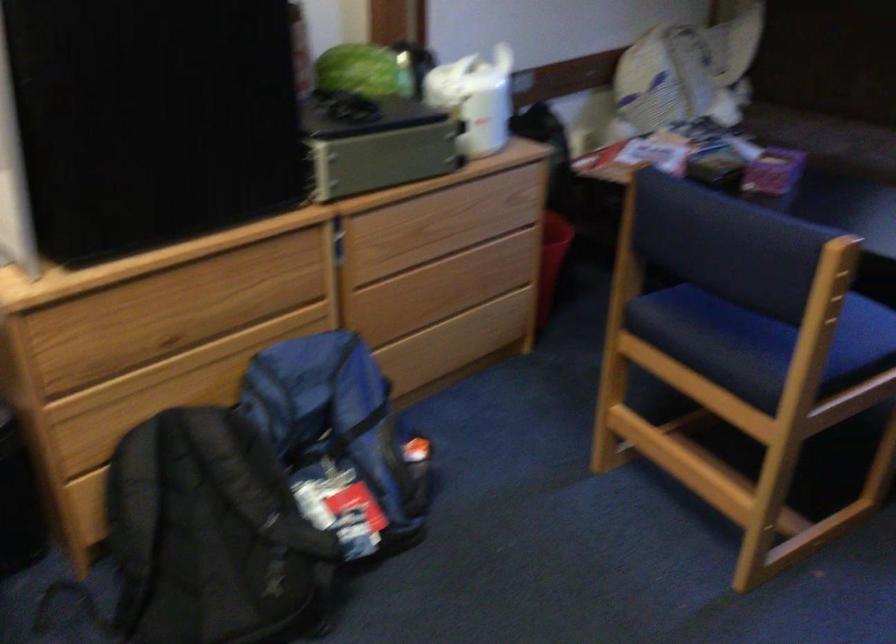
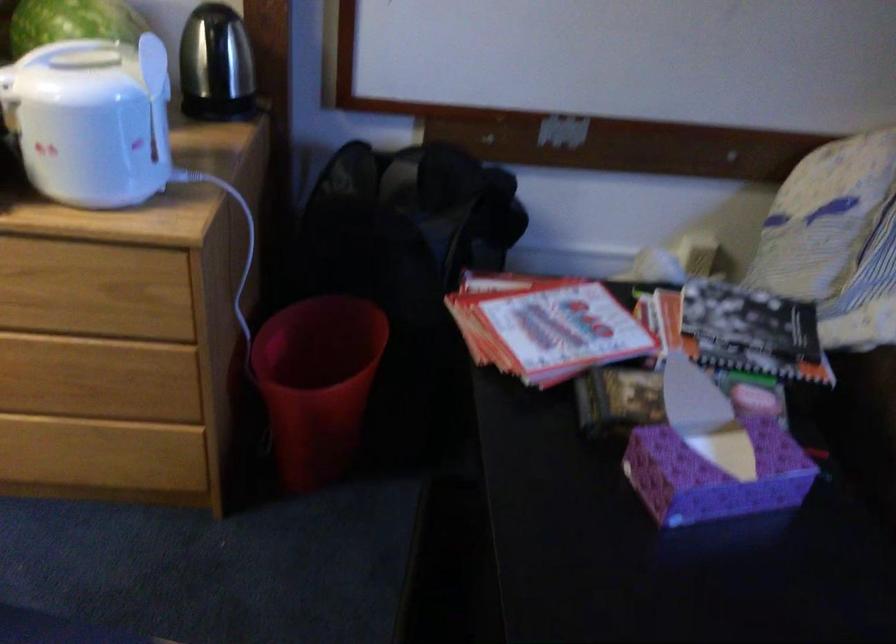
Locate, in the second image, the point that corresponds to point (782, 158) in the first image.

(714, 475)